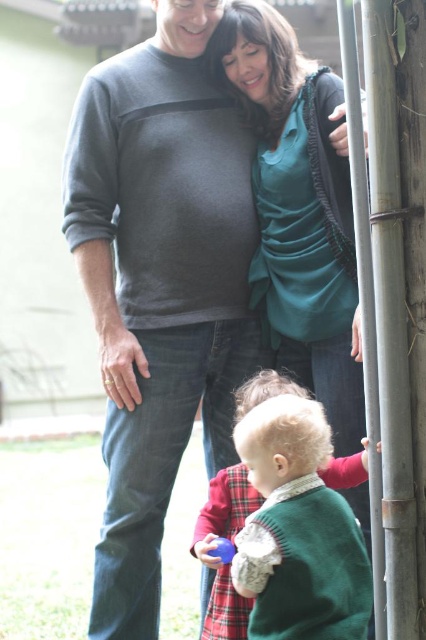
Question: Which is nearer to the green knitted sweater at lower center?

Choices:
 (A) smooth gray pole at right
 (B) teal silk blouse at upper center
 (C) dark gray sweater at upper left

Answer: (C)

Question: Is dark gray sweater at upper left smaller than teal silk blouse at upper center?

Choices:
 (A) no
 (B) yes

Answer: (A)

Question: Can you confirm if smooth gray pole at right is positioned to the right of green knitted sweater at lower center?

Choices:
 (A) no
 (B) yes

Answer: (B)

Question: Does dark gray sweater at upper left have a larger size compared to green knitted sweater at lower center?

Choices:
 (A) no
 (B) yes

Answer: (B)

Question: Which of the following is the farthest from the observer?

Choices:
 (A) (314, 285)
 (B) (409, 106)
 (C) (218, 593)

Answer: (A)

Question: Estimate the real-world distances between objects in this image. Which object is farther from the smooth gray pole at right?

Choices:
 (A) teal silk blouse at upper center
 (B) green knitted sweater at lower center
 (C) dark gray sweater at upper left

Answer: (C)